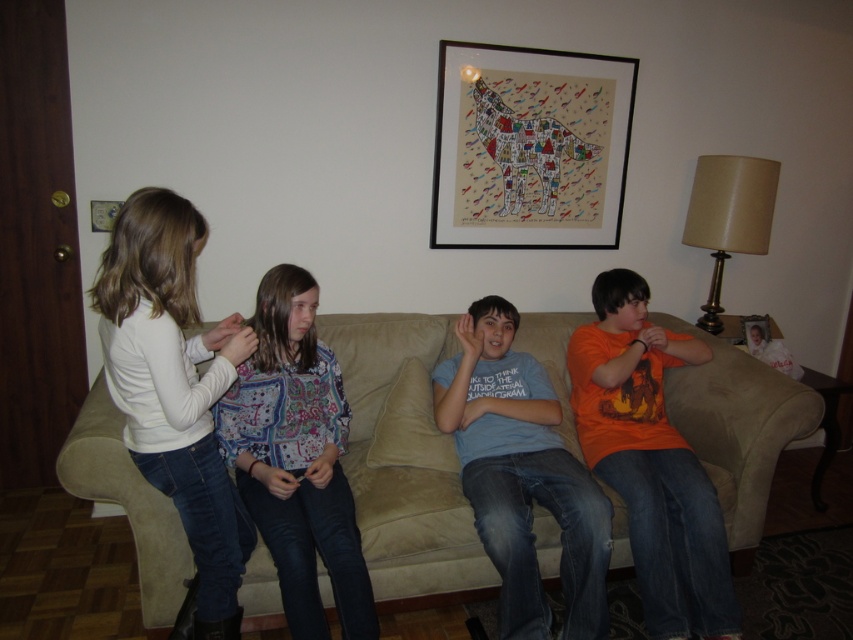
You are a visitor entering the living room and want to sit on the suede couch at center. There is a patterned fabric shirt at center in your way. Which object is closer to you so you can move it first?

The suede couch at center is closer to you than the patterned fabric shirt at center, so you should move the suede couch at center first to reach the shirt.

You are a photographer trying to capture a candid shot of the blue cotton shirt at center without including the white soft shirt at left in the frame. Is this possible based on their positions?

The white soft shirt at left is in front of the blue cotton shirt at center, so it would block the view of the blue cotton shirt at center. Therefore, capturing a shot of the blue cotton shirt at center without the white soft shirt at left would not be possible.

You are a photographer setting up a photo shoot in the living room. You need to ensure that the white soft shirt at left and the patterned fabric shirt at center are visible in the frame. Considering their heights, which shirt should you position closer to the camera to maintain visibility?

The white soft shirt at left is taller than the patterned fabric shirt at center, so positioning the white soft shirt at left closer to the camera will ensure both shirts are visible without one blocking the other.